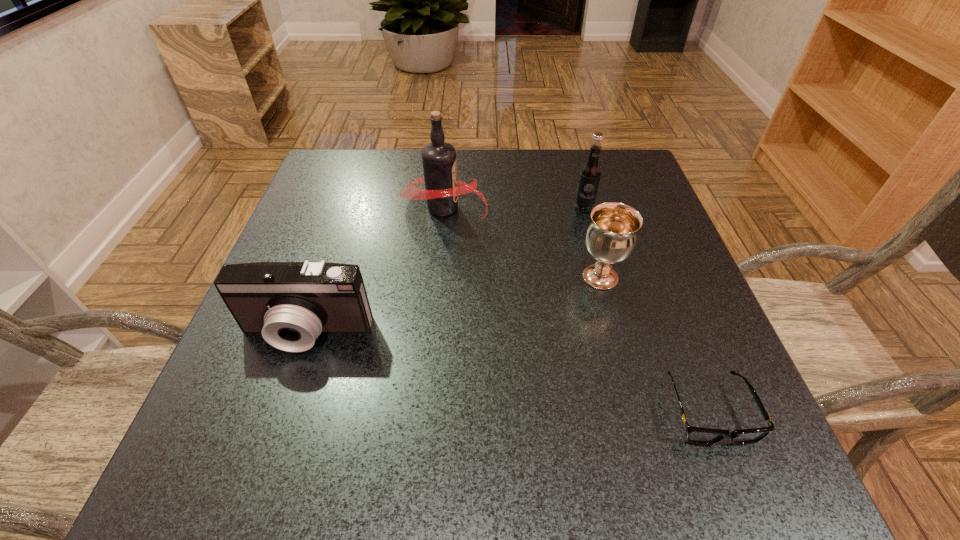
At what (x,y) coordinates should I click in order to perform the action: click on free space at the far edge of the desktop. Please return your answer as a coordinate pair (x, y). Image resolution: width=960 pixels, height=540 pixels. Looking at the image, I should click on (558, 150).

You are a GUI agent. You are given a task and a screenshot of the screen. Output one action in this format:
    pyautogui.click(x=<x>, y=<y>)
    Task: Click on the vacant space at the near edge of the desktop
    
    Given the screenshot: What is the action you would take?
    pyautogui.click(x=612, y=482)

Locate an element on the screen. free spot at the right edge of the desktop is located at coordinates [x=653, y=277].

You are a GUI agent. You are given a task and a screenshot of the screen. Output one action in this format:
    pyautogui.click(x=<x>, y=<y>)
    Task: Click on the blank space at the far left corner of the desktop
    The height and width of the screenshot is (540, 960).
    Given the screenshot: What is the action you would take?
    pyautogui.click(x=372, y=203)

At what (x,y) coordinates should I click in order to perform the action: click on free point at the far right corner. Please return your answer as a coordinate pair (x, y). Looking at the image, I should click on (576, 154).

The height and width of the screenshot is (540, 960). I want to click on vacant region between the second tallest object and the leftmost object, so click(445, 270).

Where is `free spot between the second object from left to right and the third farthest object`? free spot between the second object from left to right and the third farthest object is located at coordinates (522, 242).

Where is `vacant point located between the left root beer and the sunglasses`? The image size is (960, 540). vacant point located between the left root beer and the sunglasses is located at coordinates (576, 309).

Where is `vacant space in between the shortest object and the second nearest object`? This screenshot has height=540, width=960. vacant space in between the shortest object and the second nearest object is located at coordinates (508, 372).

This screenshot has width=960, height=540. In order to click on vacant space that's between the fourth shortest object and the taller root beer in this screenshot , I will do `click(514, 207)`.